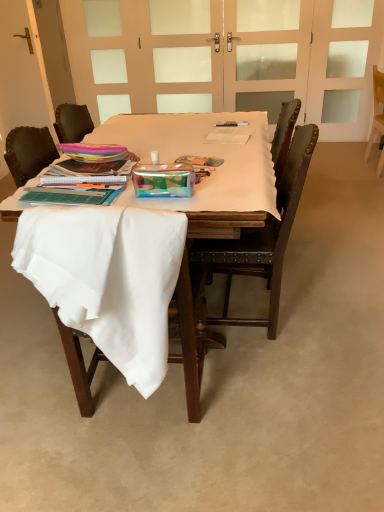
Describe the element at coordinates (344, 67) in the screenshot. The width and height of the screenshot is (384, 512). I see `white frosted glass screen door at upper right, the 3th screen door in the left-to-right sequence` at that location.

Describe the element at coordinates (185, 53) in the screenshot. The height and width of the screenshot is (512, 384). I see `white matte screen door at upper center, which is counted as the 3th screen door, starting from the right` at that location.

What do you see at coordinates (376, 109) in the screenshot? I see `wooden chair at right, the first chair in the right-to-left sequence` at bounding box center [376, 109].

Describe the element at coordinates (228, 191) in the screenshot. I see `white fabric-covered desk at center` at that location.

Find the location of a particular element. white fabric chair at lower left, which ranks as the 3th chair in back-to-front order is located at coordinates (191, 332).

Measure the distance between point (87, 392) and camera.

5.35 feet.

At what (x,y) coordinates should I click in order to perform the action: click on brown leather chair at center, the second chair in the front-to-back sequence. Please return your answer as a coordinate pair (x, y). This screenshot has height=512, width=384. Looking at the image, I should click on (260, 238).

What is the approximate height of metallic silver pen at center?

metallic silver pen at center is 1.07 inches in height.

The height and width of the screenshot is (512, 384). Identify the location of white frosted glass screen door at upper right, the 3th screen door in the left-to-right sequence. (344, 67).

Which is farther from the camera, (270, 144) or (240, 123)?

The point (240, 123) is more distant.

Can you confirm if white fabric-covered table at center is bigger than metallic silver pen at center?

Indeed, white fabric-covered table at center has a larger size compared to metallic silver pen at center.

Looking at this image, is white fabric-covered table at center placed right next to metallic silver pen at center?

There is a gap between white fabric-covered table at center and metallic silver pen at center.

Does transparent glass screen door at upper center, the second screen door in the left-to-right sequence, have a lesser height compared to white matte door at upper center?

No, transparent glass screen door at upper center, the second screen door in the left-to-right sequence, is not shorter than white matte door at upper center.

Which of these two, transparent glass screen door at upper center, which ranks as the second screen door in right-to-left order, or white matte door at upper center, is smaller?

white matte door at upper center is smaller.

Considering the positions of objects transparent glass screen door at upper center, the second screen door in the left-to-right sequence, and white matte door at upper center in the image provided, who is behind, transparent glass screen door at upper center, the second screen door in the left-to-right sequence, or white matte door at upper center?

white matte door at upper center.

In terms of height, does white frosted glass screen door at upper right, the 3th screen door in the left-to-right sequence, look taller or shorter compared to white fabric-covered desk at center?

white frosted glass screen door at upper right, the 3th screen door in the left-to-right sequence, is taller than white fabric-covered desk at center.

Which object is positioned more to the left, white frosted glass screen door at upper right, the 3th screen door in the left-to-right sequence, or white fabric-covered desk at center?

white fabric-covered desk at center is more to the left.

Considering the points (368, 92) and (275, 195), which point is behind, point (368, 92) or point (275, 195)?

The point (368, 92) is farther.

Considering the relative sizes of white frosted glass screen door at upper right, the 3th screen door in the left-to-right sequence, and white fabric-covered desk at center in the image provided, is white frosted glass screen door at upper right, the 3th screen door in the left-to-right sequence, wider than white fabric-covered desk at center?

Incorrect, the width of white frosted glass screen door at upper right, the 3th screen door in the left-to-right sequence, does not surpass that of white fabric-covered desk at center.

From a real-world perspective, is wooden chair at right, the first chair in the right-to-left sequence, physically below white matte screen door at upper center, which is counted as the 3th screen door, starting from the right?

Yes, from a real-world perspective, wooden chair at right, the first chair in the right-to-left sequence, is beneath white matte screen door at upper center, which is counted as the 3th screen door, starting from the right.

From the image's perspective, is wooden chair at right, placed as the 3th chair when sorted from front to back, on top of white matte screen door at upper center, which appears as the first screen door when viewed from the left?

No, from the image's perspective, wooden chair at right, placed as the 3th chair when sorted from front to back, is not above white matte screen door at upper center, which appears as the first screen door when viewed from the left.

Can you confirm if wooden chair at right, placed as the 3th chair when sorted from front to back, is wider than white matte screen door at upper center, which is counted as the 3th screen door, starting from the right?

Correct, the width of wooden chair at right, placed as the 3th chair when sorted from front to back, exceeds that of white matte screen door at upper center, which is counted as the 3th screen door, starting from the right.

Is wooden chair at right, placed as the 3th chair when sorted from front to back, positioned with its back to white matte screen door at upper center, which is counted as the 3th screen door, starting from the right?

No, wooden chair at right, placed as the 3th chair when sorted from front to back,'s orientation is not away from white matte screen door at upper center, which is counted as the 3th screen door, starting from the right.

Is brown leather chair at center, the second chair in the front-to-back sequence, positioned far away from transparent glass screen door at upper center, the second screen door in the left-to-right sequence?

Yes, brown leather chair at center, the second chair in the front-to-back sequence, and transparent glass screen door at upper center, the second screen door in the left-to-right sequence, are located far from each other.

Identify the location of the 1st screen door counting from the right of the brown leather chair at center, which is counted as the second chair, starting from the left. The width and height of the screenshot is (384, 512). (266, 54).

Is brown leather chair at center, which is counted as the second chair, starting from the left, smaller than transparent glass screen door at upper center, which ranks as the second screen door in right-to-left order?

Incorrect, brown leather chair at center, which is counted as the second chair, starting from the left, is not smaller in size than transparent glass screen door at upper center, which ranks as the second screen door in right-to-left order.

Is transparent glass screen door at upper center, which ranks as the second screen door in right-to-left order, at the back of brown leather chair at center, which ranks as the 2th chair in right-to-left order?

brown leather chair at center, which ranks as the 2th chair in right-to-left order, does not have its back to transparent glass screen door at upper center, which ranks as the second screen door in right-to-left order.

Which object is further away from the camera taking this photo, transparent glass screen door at upper center, the second screen door in the left-to-right sequence, or white frosted glass screen door at upper right, the 3th screen door in the left-to-right sequence?

Positioned behind is transparent glass screen door at upper center, the second screen door in the left-to-right sequence.

From a real-world perspective, is transparent glass screen door at upper center, which ranks as the second screen door in right-to-left order, positioned above or below white frosted glass screen door at upper right, placed as the first screen door when sorted from right to left?

From a real-world perspective, transparent glass screen door at upper center, which ranks as the second screen door in right-to-left order, is physically above white frosted glass screen door at upper right, placed as the first screen door when sorted from right to left.

Image resolution: width=384 pixels, height=512 pixels. Identify the location of screen door located below the transparent glass screen door at upper center, which ranks as the second screen door in right-to-left order (from the image's perspective). (344, 67).

What's the angular difference between transparent glass screen door at upper center, the second screen door in the left-to-right sequence, and white frosted glass screen door at upper right, placed as the first screen door when sorted from right to left,'s facing directions?

The facing directions of transparent glass screen door at upper center, the second screen door in the left-to-right sequence, and white frosted glass screen door at upper right, placed as the first screen door when sorted from right to left, are 0.00224 degrees apart.

Between point (369, 139) and point (342, 44), which one is positioned behind?

Point (369, 139)

Is wooden chair at right, placed as the 3th chair when sorted from front to back, turned away from white frosted glass screen door at upper right, the 3th screen door in the left-to-right sequence?

wooden chair at right, placed as the 3th chair when sorted from front to back, is not turned away from white frosted glass screen door at upper right, the 3th screen door in the left-to-right sequence.

How far apart are wooden chair at right, arranged as the 1th chair when viewed from the back, and white frosted glass screen door at upper right, the 3th screen door in the left-to-right sequence?

They are 13.84 inches apart.

In the scene shown: Is wooden chair at right, the first chair in the right-to-left sequence, located outside white frosted glass screen door at upper right, the 3th screen door in the left-to-right sequence?

Yes.

The height and width of the screenshot is (512, 384). I want to click on pen behind the white fabric-covered table at center, so click(x=232, y=124).

From the white matte door at upper center, count 2nd screen doors forward and point to it. Please provide its 2D coordinates.

[(266, 54)]

Considering their positions, is brown leather chair at center, placed as the second chair when sorted from back to front, positioned further to white matte door at upper center than white fabric-covered desk at center?

brown leather chair at center, placed as the second chair when sorted from back to front.

Looking at the image, which one is located further to white fabric chair at lower left, marked as the first chair in a left-to-right arrangement, white fabric-covered table at center or transparent glass screen door at upper center, the second screen door in the left-to-right sequence?

transparent glass screen door at upper center, the second screen door in the left-to-right sequence, is positioned further to the anchor white fabric chair at lower left, marked as the first chair in a left-to-right arrangement.

Estimate the real-world distances between objects in this image. Which object is further from metallic silver pen at center, transparent glass screen door at upper center, the second screen door in the left-to-right sequence, or white frosted glass screen door at upper right, the 3th screen door in the left-to-right sequence?

white frosted glass screen door at upper right, the 3th screen door in the left-to-right sequence, is positioned further to the anchor metallic silver pen at center.

When comparing their distances from white matte door at upper center, does metallic silver pen at center or wooden chair at right, arranged as the 3th chair when viewed from the left, seem closer?

Among the two, wooden chair at right, arranged as the 3th chair when viewed from the left, is located nearer to white matte door at upper center.

Considering their positions, is transparent glass screen door at upper center, which ranks as the second screen door in right-to-left order, positioned further to white fabric-covered table at center than white frosted glass screen door at upper right, the 3th screen door in the left-to-right sequence?

Among the two, white frosted glass screen door at upper right, the 3th screen door in the left-to-right sequence, is located further to white fabric-covered table at center.

Considering their positions, is white fabric-covered desk at center positioned further to brown leather chair at center, placed as the second chair when sorted from back to front, than metallic silver pen at center?

metallic silver pen at center lies further to brown leather chair at center, placed as the second chair when sorted from back to front, than the other object.

From the image, which object appears to be farther from white matte screen door at upper center, which is counted as the 3th screen door, starting from the right, transparent glass screen door at upper center, the second screen door in the left-to-right sequence, or wooden chair at right, the first chair in the right-to-left sequence?

Based on the image, wooden chair at right, the first chair in the right-to-left sequence, appears to be further to white matte screen door at upper center, which is counted as the 3th screen door, starting from the right.

From the image, which object appears to be nearer to brown leather chair at center, placed as the second chair when sorted from back to front, white matte screen door at upper center, which is counted as the 3th screen door, starting from the right, or white fabric chair at lower left, marked as the first chair in a left-to-right arrangement?

Based on the image, white fabric chair at lower left, marked as the first chair in a left-to-right arrangement, appears to be nearer to brown leather chair at center, placed as the second chair when sorted from back to front.

You are a GUI agent. You are given a task and a screenshot of the screen. Output one action in this format:
    pyautogui.click(x=<x>, y=<y>)
    Task: Click on the pen between white fabric chair at lower left, which ranks as the 3th chair in back-to-front order, and transparent glass screen door at upper center, the second screen door in the left-to-right sequence, in the front-back direction
    Image resolution: width=384 pixels, height=512 pixels.
    Given the screenshot: What is the action you would take?
    pyautogui.click(x=232, y=124)

The width and height of the screenshot is (384, 512). I want to click on desk positioned between white fabric-covered table at center and wooden chair at right, arranged as the 3th chair when viewed from the left, from near to far, so click(228, 191).

At what (x,y) coordinates should I click in order to perform the action: click on pen between white fabric-covered desk at center and wooden chair at right, arranged as the 3th chair when viewed from the left. Please return your answer as a coordinate pair (x, y). This screenshot has height=512, width=384. Looking at the image, I should click on (232, 124).

Where is `pen located between white fabric-covered desk at center and white frosted glass screen door at upper right, the 3th screen door in the left-to-right sequence, in the depth direction`? The width and height of the screenshot is (384, 512). pen located between white fabric-covered desk at center and white frosted glass screen door at upper right, the 3th screen door in the left-to-right sequence, in the depth direction is located at coordinates (232, 124).